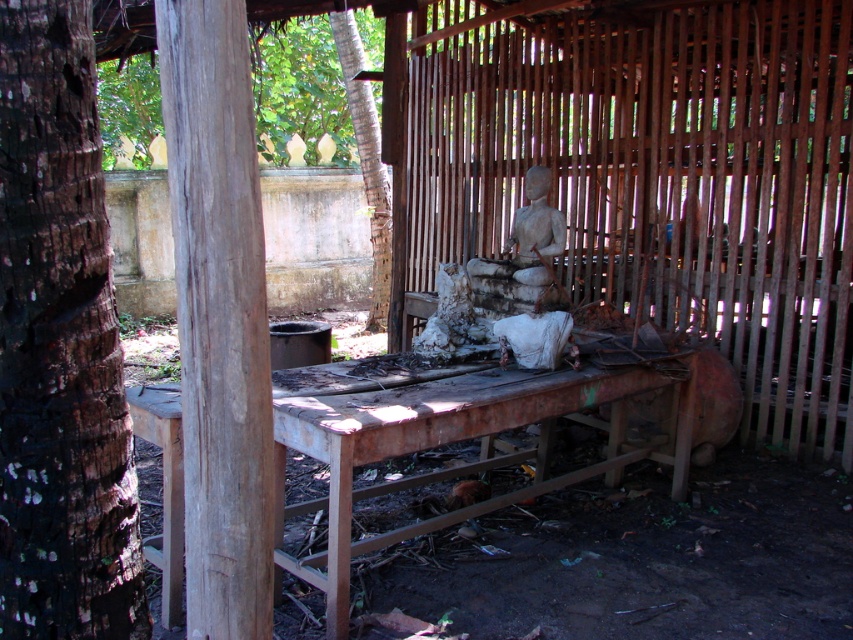
Question: Which of these objects is positioned closest to the weathered wood post at center?

Choices:
 (A) rusty metal picnic table at center
 (B) brown rough bark tree at left

Answer: (B)

Question: Is weathered wood post at center thinner than rusty metal picnic table at center?

Choices:
 (A) no
 (B) yes

Answer: (B)

Question: Does brown rough bark tree at left come in front of weathered wood post at center?

Choices:
 (A) no
 (B) yes

Answer: (B)

Question: In this image, where is weathered wood post at center located relative to rusty metal picnic table at center?

Choices:
 (A) above
 (B) below

Answer: (A)

Question: Which of the following is the closest to the observer?

Choices:
 (A) weathered wood post at center
 (B) brown rough bark tree at left
 (C) brown bark tree at upper left
 (D) rusty metal picnic table at center

Answer: (B)

Question: Estimate the real-world distances between objects in this image. Which object is closer to the brown rough bark tree at left?

Choices:
 (A) rusty metal picnic table at center
 (B) brown bark tree at upper left

Answer: (A)